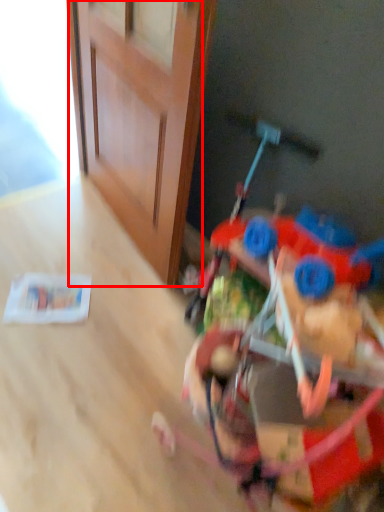
Question: From the image's perspective, where is door (annotated by the red box) located in relation to toy in the image?

Choices:
 (A) above
 (B) below

Answer: (A)